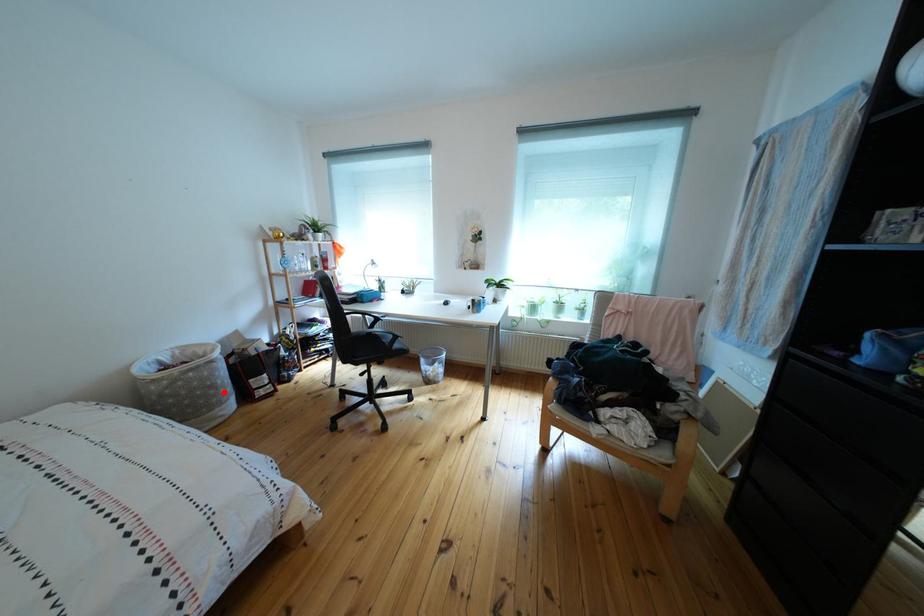
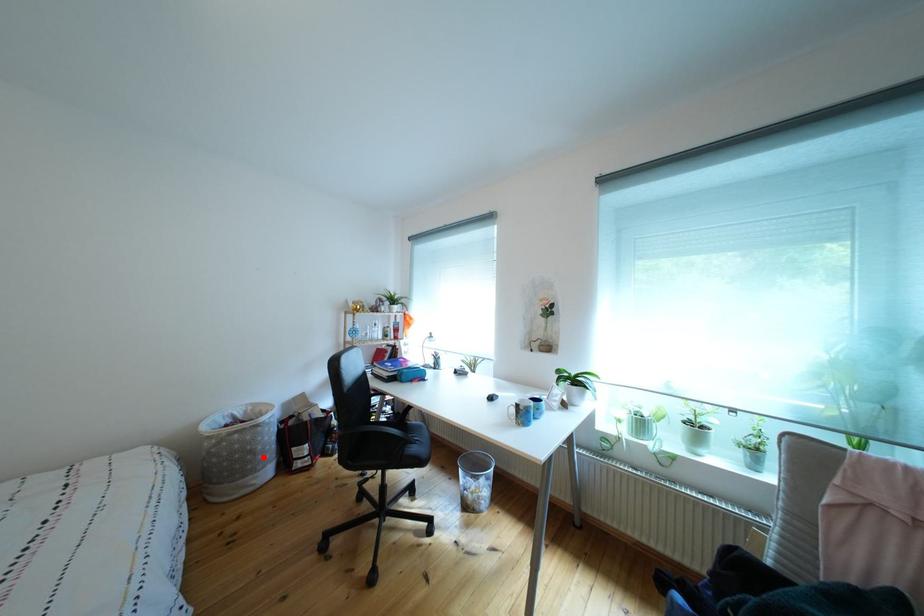
I am providing you with two images of the same scene from different viewpoints. A red point is marked on the first image and another point is marked on the second image. Are the points marked in image1 and image2 representing the same 3D position?

Yes